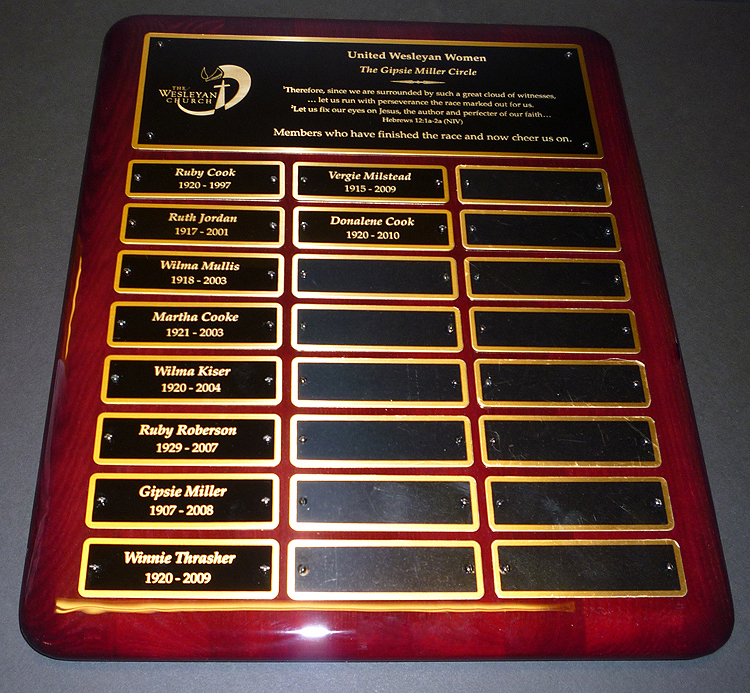
Locate an element on the screen. Image resolution: width=750 pixels, height=693 pixels. large plate is located at coordinates point(273,73), point(532,70).